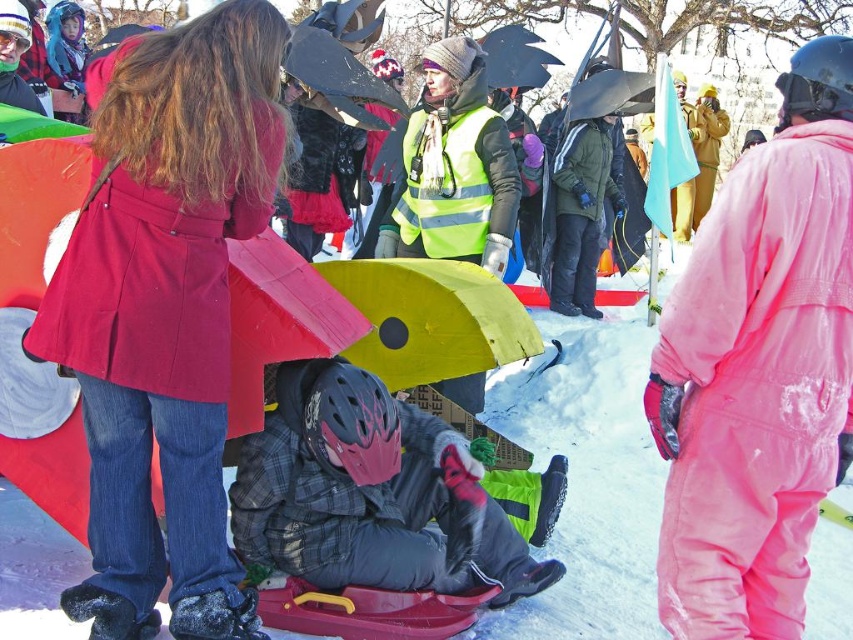
Is pink snowsuit at right to the right of plaid fabric snowboard at center from the viewer's perspective?

Correct, you'll find pink snowsuit at right to the right of plaid fabric snowboard at center.

Which is more to the right, pink snowsuit at right or plaid fabric snowboard at center?

pink snowsuit at right is more to the right.

Is point (814, 298) closer to viewer compared to point (293, 554)?

Yes.

Where is `pink snowsuit at right`? This screenshot has width=853, height=640. pink snowsuit at right is located at coordinates (759, 369).

Does pink snowsuit at right appear over white fluffy snow at center?

Correct, pink snowsuit at right is located above white fluffy snow at center.

Which is in front, point (801, 64) or point (585, 449)?

Point (801, 64) is more forward.

Find the location of `pink snowsuit at right`. pink snowsuit at right is located at coordinates (759, 369).

Who is lower down, white fluffy snow at center or plaid fabric snowboard at center?

white fluffy snow at center is lower down.

Does point (660, 490) come farther from viewer compared to point (523, 593)?

Yes, point (660, 490) is farther from viewer.

Locate an element on the screen. Image resolution: width=853 pixels, height=640 pixels. white fluffy snow at center is located at coordinates (587, 477).